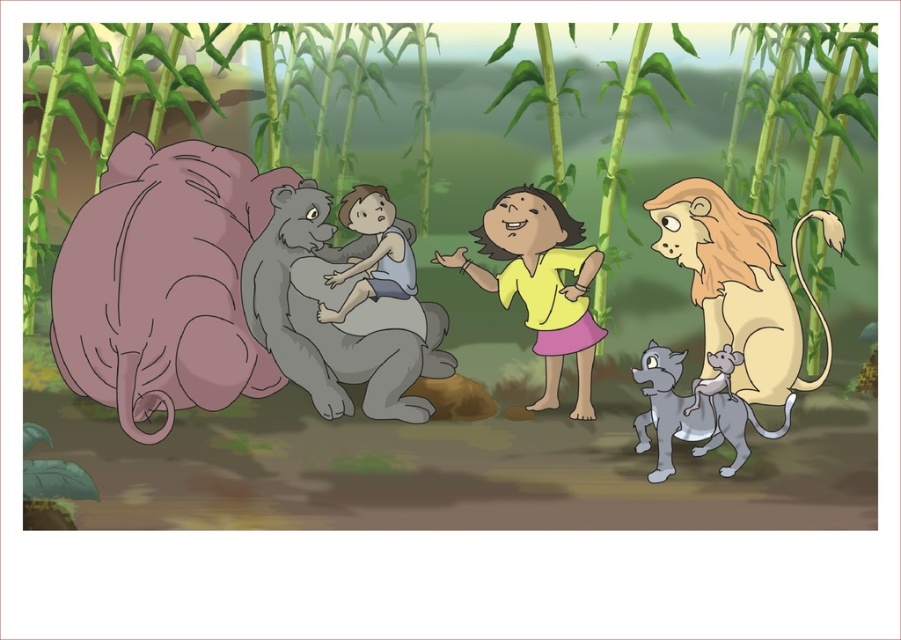
Between point (102, 358) and point (388, 204), which one is positioned in front?

Point (102, 358) is in front.

Who is positioned more to the right, matte pink hippo at left or smooth gray fur at center?

smooth gray fur at center is more to the right.

Is point (265, 227) positioned in front of point (394, 285)?

Yes, it is.

In order to click on matte pink hippo at left in this screenshot , I will do `click(223, 294)`.

Does green bamboo at center have a lesser width compared to matte pink hippo at left?

No.

Who is positioned more to the left, green bamboo at center or matte pink hippo at left?

matte pink hippo at left

Identify the location of green bamboo at center. (471, 115).

Image resolution: width=901 pixels, height=640 pixels. Identify the location of green bamboo at center. click(471, 115).

Which is more to the left, gray furry bear at center or yellow matte shirt at center?

From the viewer's perspective, gray furry bear at center appears more on the left side.

Which is behind, point (405, 266) or point (454, 268)?

Point (405, 266)

The image size is (901, 640). I want to click on gray furry bear at center, so click(x=343, y=304).